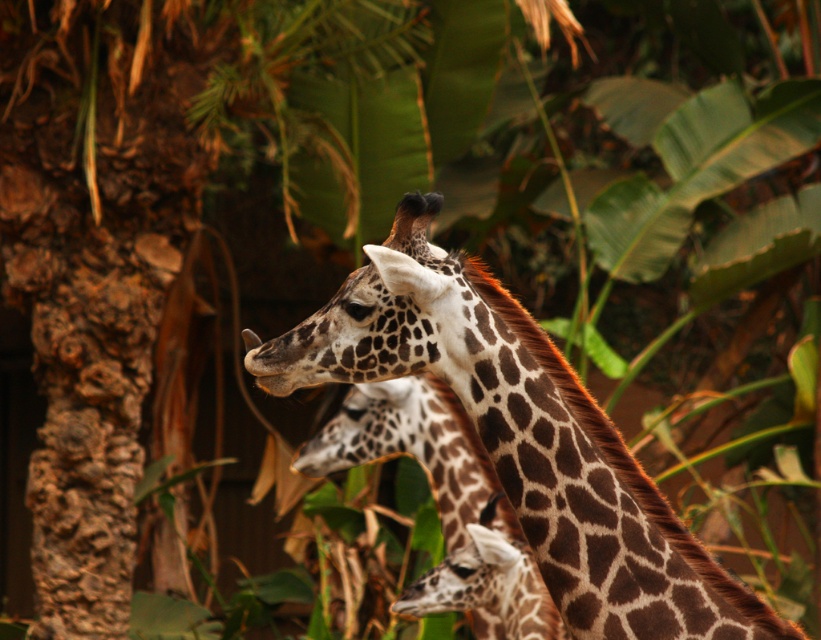
Question: Can you confirm if spotted fur giraffe at center is positioned to the right of brown spotted giraffe at center?

Choices:
 (A) yes
 (B) no

Answer: (A)

Question: Is spotted fur giraffe at center behind brown spotted giraffe at center?

Choices:
 (A) yes
 (B) no

Answer: (B)

Question: Which point is closer to the camera?

Choices:
 (A) spotted fur giraffe at center
 (B) brown spotted giraffe at center

Answer: (A)

Question: From the image, what is the correct spatial relationship of spotted fur giraffe at center in relation to brown spotted giraffe at center?

Choices:
 (A) right
 (B) left

Answer: (A)